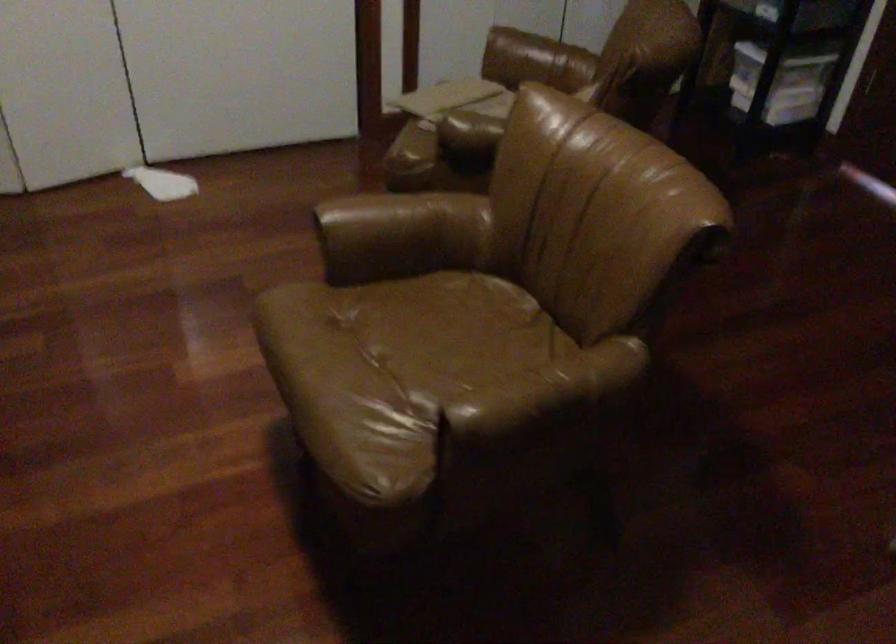
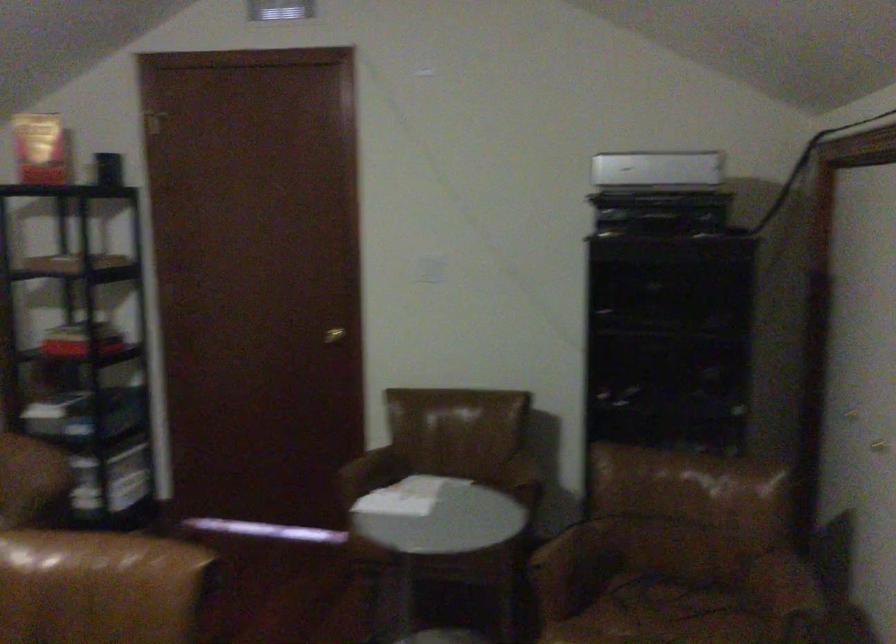
Question: The camera is either moving clockwise (left) or counter-clockwise (right) around the object. The first image is from the beginning of the video and the second image is from the end. Is the camera moving left or right when shooting the video?

Choices:
 (A) Left
 (B) Right

Answer: (A)